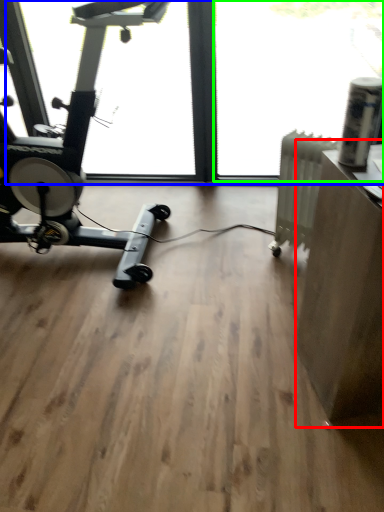
Question: Considering the real-world distances, which object is closest to computer desk (highlighted by a red box)? window screen (highlighted by a blue box) or window screen (highlighted by a green box).

Choices:
 (A) window screen
 (B) window screen

Answer: (A)